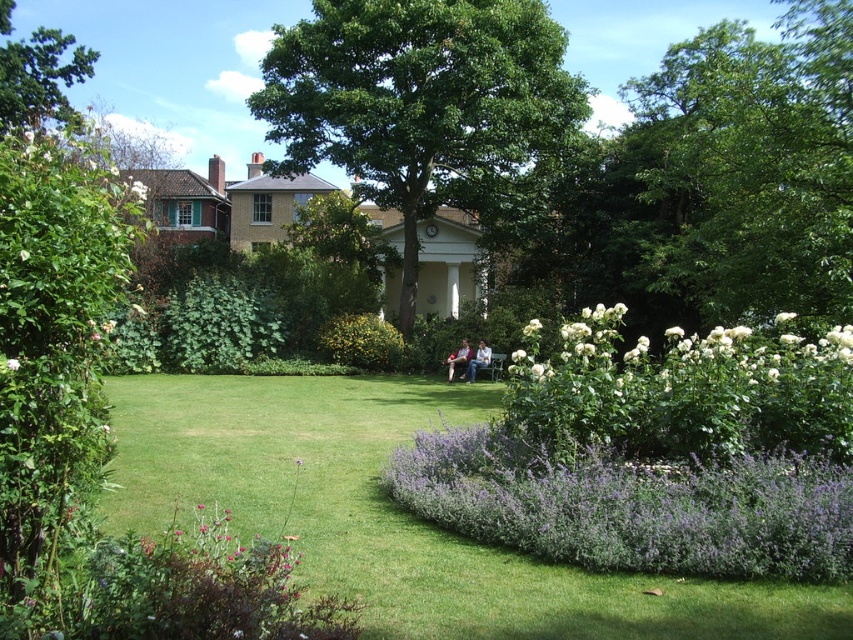
You are a gardener who wants to place a new statue exactly between the white fluffy flowers at right and the light brown wooden bench at center. Based on their positions, will the statue be placed in front of or behind the bench?

The white fluffy flowers at right is above the light brown wooden bench at center, so placing a statue between them would mean it is in front of the bench since the flowers are elevated.

You are planning to place a small garden statue between the white fluffy flowers at right and the light brown wooden bench at center. Based on their positions, which side of the bench should the statue be placed on?

The white fluffy flowers at right is to the right of the light brown wooden bench at center, so the statue should be placed to the right side of the light brown wooden bench at center.